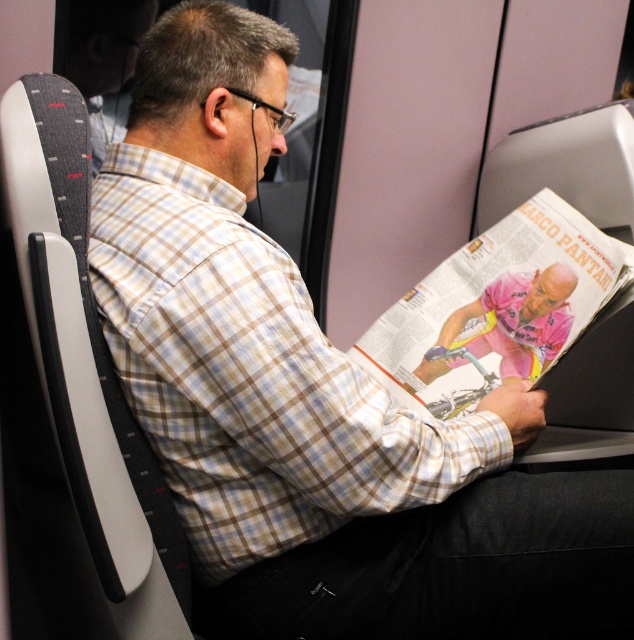
Question: Does checkered fabric shirt at center have a smaller size compared to pink fabric magazine at center?

Choices:
 (A) no
 (B) yes

Answer: (A)

Question: Is black denim pants at lower center closer to the viewer compared to pink fabric magazine at center?

Choices:
 (A) no
 (B) yes

Answer: (B)

Question: Which of these objects is positioned farthest from the black denim pants at lower center?

Choices:
 (A) pink jersey cyclist at center
 (B) checkered fabric shirt at center

Answer: (A)

Question: Among these points, which one is nearest to the camera?

Choices:
 (A) (261, 589)
 (B) (493, 301)
 (C) (571, 248)
 (D) (358, 380)

Answer: (D)

Question: Does checkered fabric shirt at center have a larger size compared to pink fabric magazine at center?

Choices:
 (A) no
 (B) yes

Answer: (B)

Question: Which object is closer to the camera taking this photo?

Choices:
 (A) black denim pants at lower center
 (B) pink jersey cyclist at center
 (C) pink fabric magazine at center

Answer: (A)